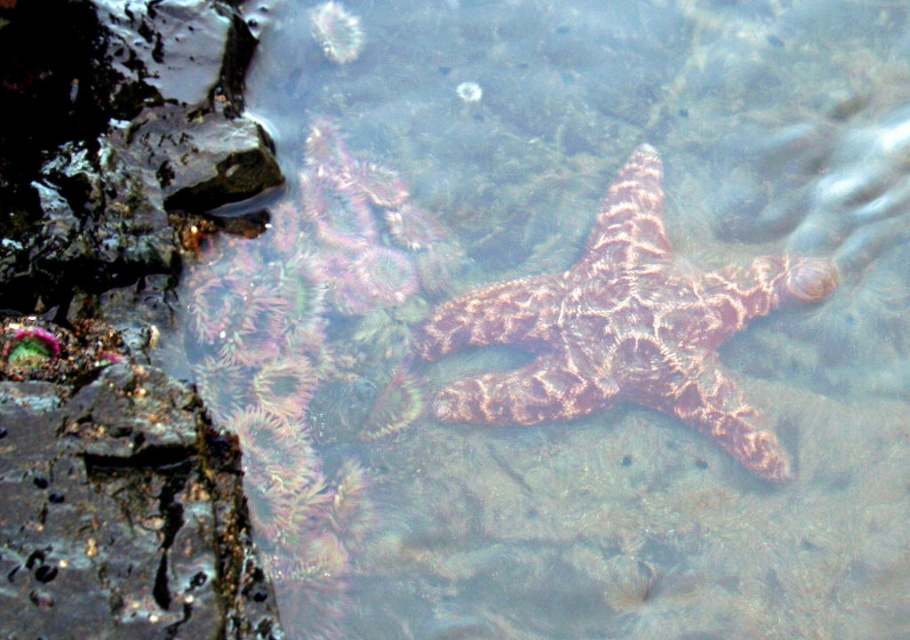
Question: Can you confirm if rusty metallic rock at left is wider than rusty textured starfish at center?

Choices:
 (A) no
 (B) yes

Answer: (A)

Question: Which point is closer to the camera?

Choices:
 (A) (634, 392)
 (B) (263, 630)

Answer: (B)

Question: Is rusty metallic rock at left smaller than rusty textured starfish at center?

Choices:
 (A) yes
 (B) no

Answer: (A)

Question: Which point is farther from the camera taking this photo?

Choices:
 (A) (95, 637)
 (B) (489, 378)

Answer: (B)

Question: Does rusty metallic rock at left have a lesser width compared to rusty textured starfish at center?

Choices:
 (A) yes
 (B) no

Answer: (A)

Question: Which of the following is the closest to the observer?

Choices:
 (A) rusty metallic rock at left
 (B) rusty textured starfish at center

Answer: (A)